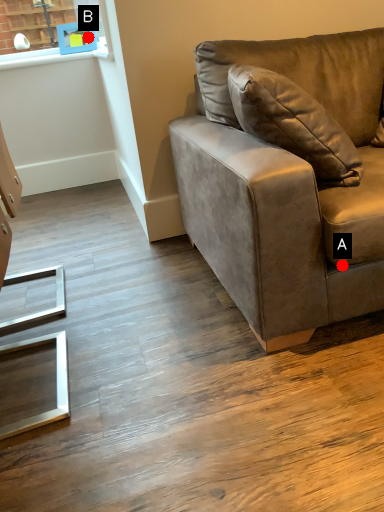
Question: Two points are circled on the image, labeled by A and B beside each circle. Which point is further to the camera?

Choices:
 (A) A is further
 (B) B is further

Answer: (B)